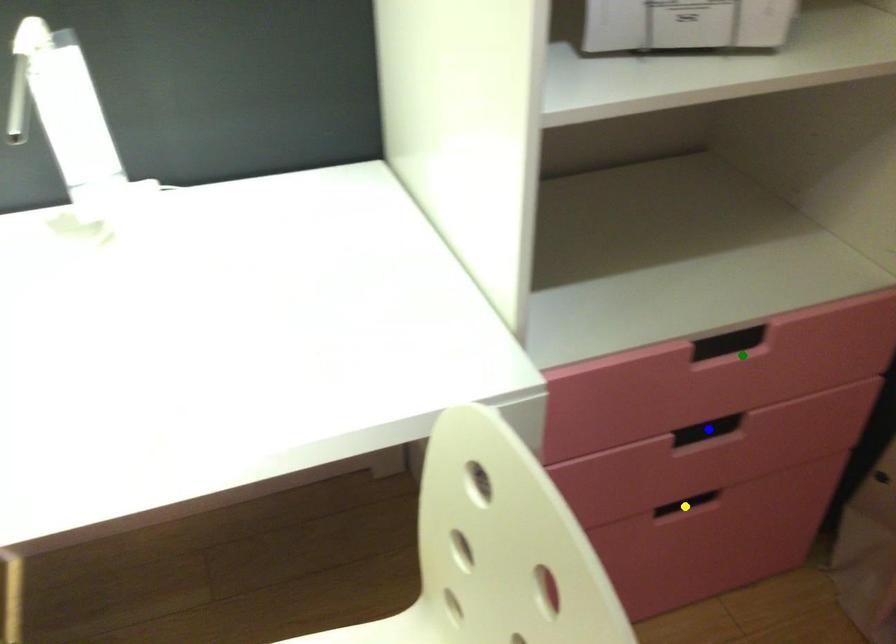
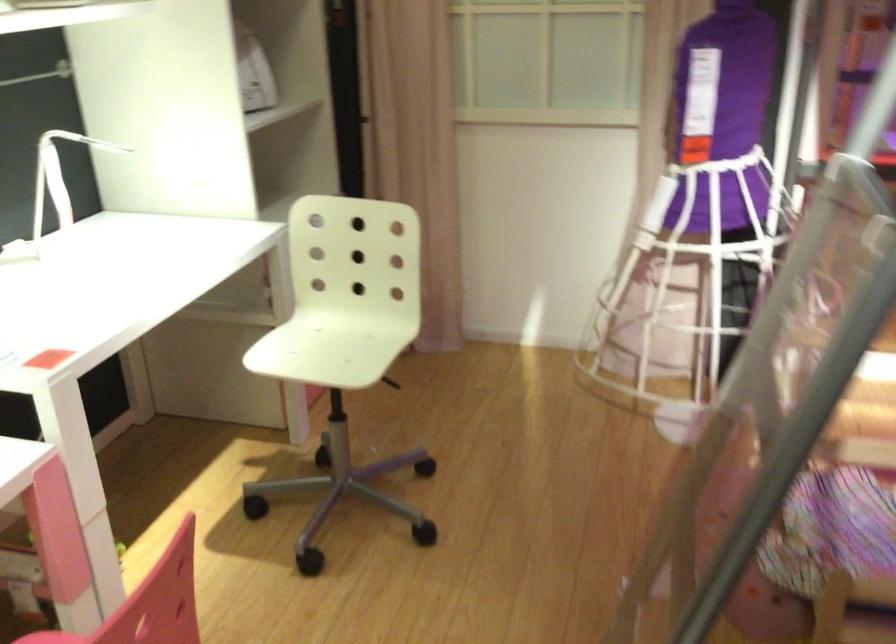
I am providing you with two images of the same scene from different viewpoints. Three points are marked in image1. Which point corresponds to a part or object that is occluded in image2?In image1, three points are marked. Which of them correspond to a part or object that is occluded in image2?Among the three points shown in image1, which one corresponds to a part or object that is no longer visible due to occlusion in image2?

blue point, yellow point, green point